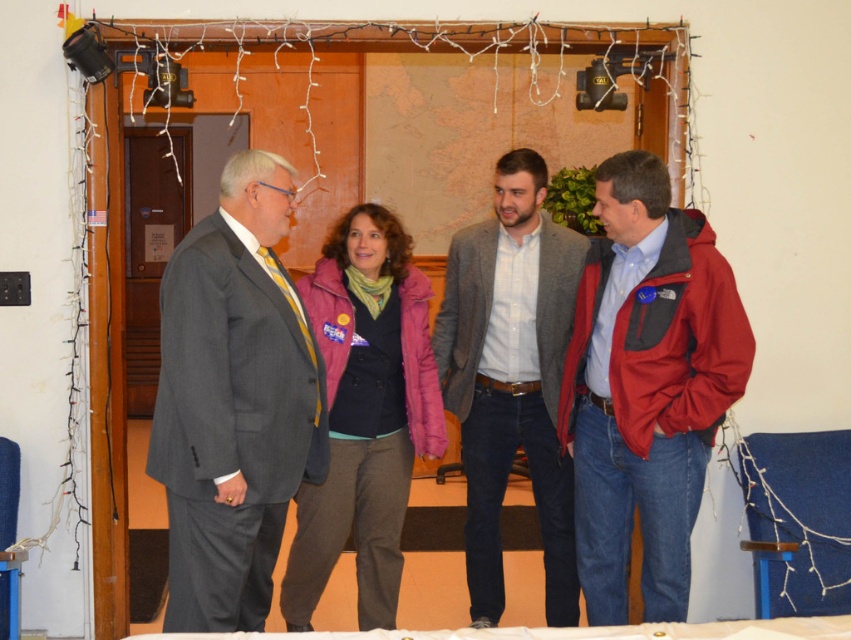
You are a photographer at the event and want to ensure all four individuals are visible in a group photo. Given the height differences between the red softshell jacket at right and the gray woolen blazer at center, where should the camera be positioned to capture everyone without any obstruction?

The red softshell jacket at right is shorter than the gray woolen blazer at center. To ensure all four individuals are visible without obstruction, position the camera at a lower angle so that taller individuals like the one in the gray woolen blazer at center do not block shorter ones in the red softshell jacket at right.

You are standing in the room and want to move from the table to the group of four people. Which point, point [644,412] or point [437,339], is closer to you?

Point [644,412] is closer to the viewer than point [437,339], so you should head toward point [644,412] first.